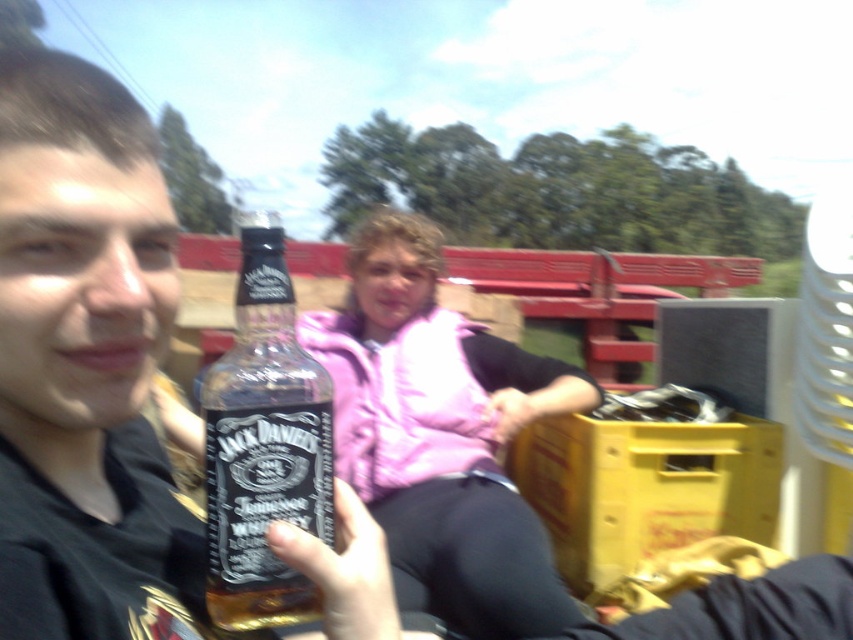
Question: Which point is closer to the camera taking this photo?

Choices:
 (A) (473, 525)
 (B) (219, 385)
 (C) (15, 372)

Answer: (C)

Question: Can you confirm if matte glass bottle at center is positioned to the left of clear glass bottle at center?

Choices:
 (A) no
 (B) yes

Answer: (B)

Question: Which of these objects is positioned closest to the pink fabric vest at center?

Choices:
 (A) clear glass bottle at center
 (B) matte glass bottle at center

Answer: (A)

Question: Which of the following is the closest to the observer?

Choices:
 (A) (202, 630)
 (B) (363, 436)

Answer: (A)

Question: Is matte glass bottle at center further to camera compared to pink fabric vest at center?

Choices:
 (A) yes
 (B) no

Answer: (B)

Question: Does pink fabric vest at center come behind clear glass bottle at center?

Choices:
 (A) yes
 (B) no

Answer: (A)